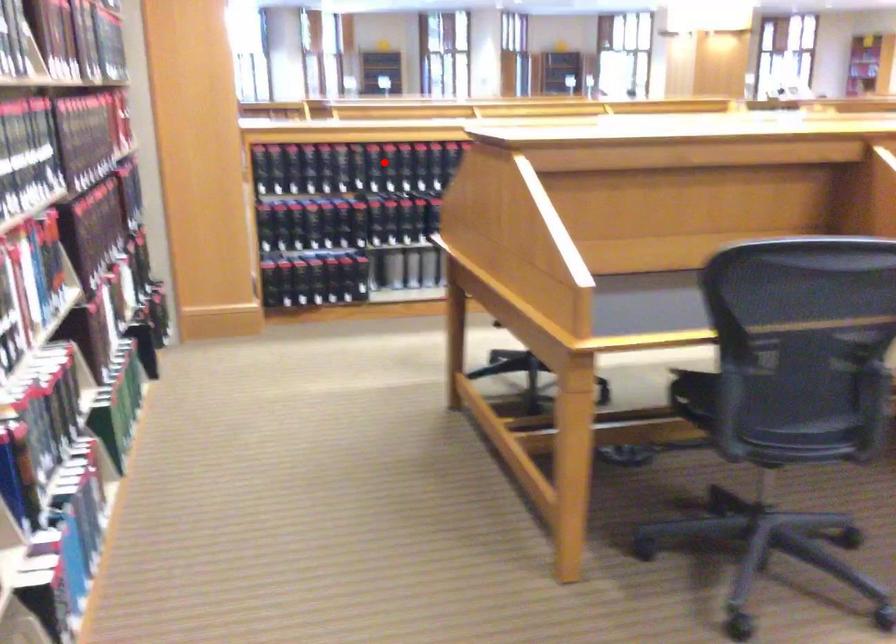
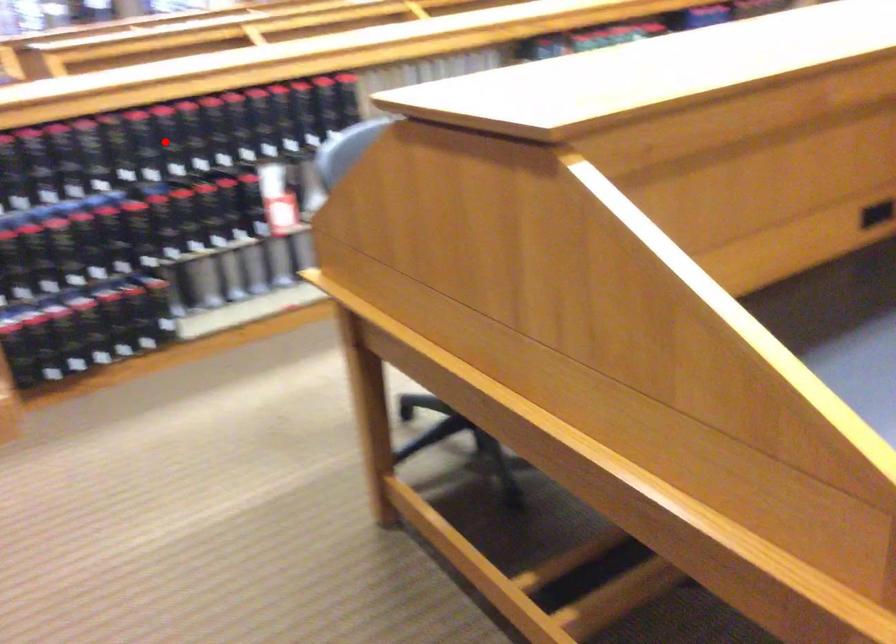
Looking at this image, I am providing you with two images of the same scene from different viewpoints. A red point is marked on the first image and another point is marked on the second image. Is the red point in image1 aligned with the point shown in image2?

Yes